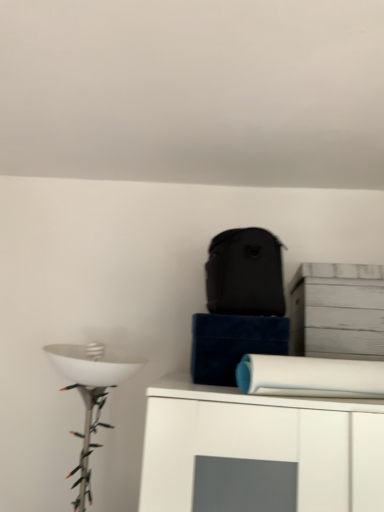
Question: Should I look upward or downward to see white matte toilet paper at upper right?

Choices:
 (A) down
 (B) up

Answer: (A)

Question: Can you see white matte toilet paper at upper right touching white wood cabinet at upper right?

Choices:
 (A) yes
 (B) no

Answer: (B)

Question: Does white matte toilet paper at upper right come in front of white wood cabinet at upper right?

Choices:
 (A) no
 (B) yes

Answer: (B)

Question: Is white matte toilet paper at upper right thinner than white wood cabinet at upper right?

Choices:
 (A) yes
 (B) no

Answer: (B)

Question: Is white matte toilet paper at upper right not close to white wood cabinet at upper right?

Choices:
 (A) yes
 (B) no

Answer: (B)

Question: Does white matte toilet paper at upper right have a lesser height compared to white wood cabinet at upper right?

Choices:
 (A) no
 (B) yes

Answer: (B)

Question: Can you confirm if white matte toilet paper at upper right is taller than white wood cabinet at upper right?

Choices:
 (A) no
 (B) yes

Answer: (A)

Question: From a real-world perspective, is white wood cabinet at upper right over white matte toilet paper at upper right?

Choices:
 (A) yes
 (B) no

Answer: (A)

Question: Is white wood cabinet at upper right closer to camera compared to white matte toilet paper at upper right?

Choices:
 (A) no
 (B) yes

Answer: (A)

Question: From the image's perspective, is white wood cabinet at upper right below white matte toilet paper at upper right?

Choices:
 (A) yes
 (B) no

Answer: (B)

Question: Considering the relative positions of white wood cabinet at upper right and white matte toilet paper at upper right in the image provided, is white wood cabinet at upper right to the left of white matte toilet paper at upper right from the viewer's perspective?

Choices:
 (A) no
 (B) yes

Answer: (A)

Question: Does white wood cabinet at upper right lie behind white matte toilet paper at upper right?

Choices:
 (A) no
 (B) yes

Answer: (B)

Question: Is white wood cabinet at upper right bigger than white matte toilet paper at upper right?

Choices:
 (A) no
 (B) yes

Answer: (A)

Question: Which is correct: white wood cabinet at upper right is inside white matte toilet paper at upper right, or outside of it?

Choices:
 (A) inside
 (B) outside

Answer: (B)